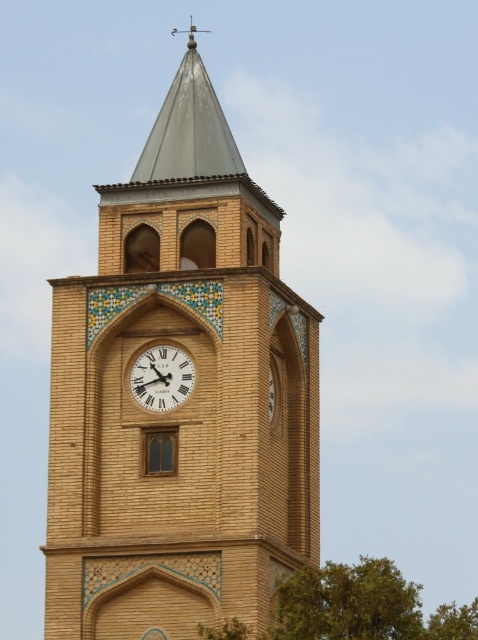
Does point (78, 285) come farther from viewer compared to point (176, 404)?

Yes, it is.

Between point (267, 260) and point (156, 372), which one is positioned in front?

Point (156, 372) is more forward.

Find the location of `brown brick clock tower at center`. brown brick clock tower at center is located at coordinates (183, 401).

The width and height of the screenshot is (478, 640). I want to click on brown brick clock tower at center, so click(183, 401).

Is point (155, 518) in front of point (379, 628)?

That is False.

Does point (206, 246) come behind point (304, 600)?

Yes, it is.

Which is behind, point (130, 352) or point (334, 634)?

Point (130, 352)

Find the location of a particular element. brown brick clock tower at center is located at coordinates (183, 401).

Can you confirm if green leafy tree at lower right is thinner than white wooden clock at center?

In fact, green leafy tree at lower right might be wider than white wooden clock at center.

Is point (361, 605) in front of point (188, 380)?

Yes, point (361, 605) is in front of point (188, 380).

This screenshot has height=640, width=478. I want to click on green leafy tree at lower right, so click(x=361, y=605).